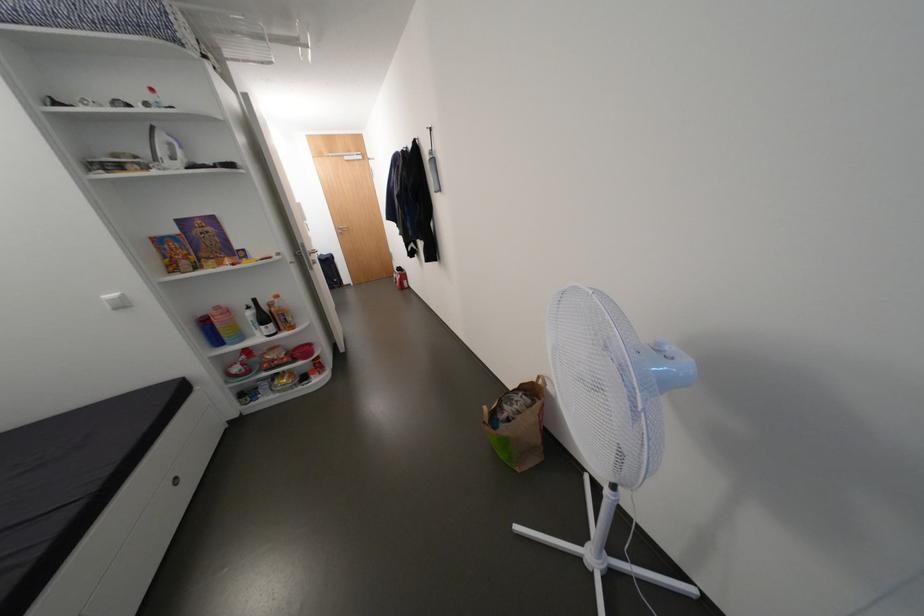
The location [263,320] corresponds to which object?

It refers to a dark wine bottle.